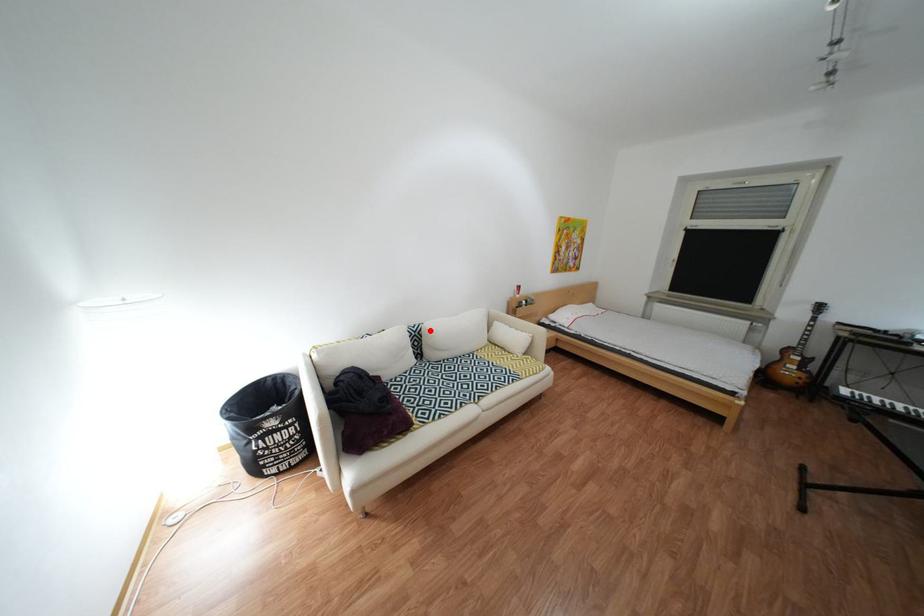
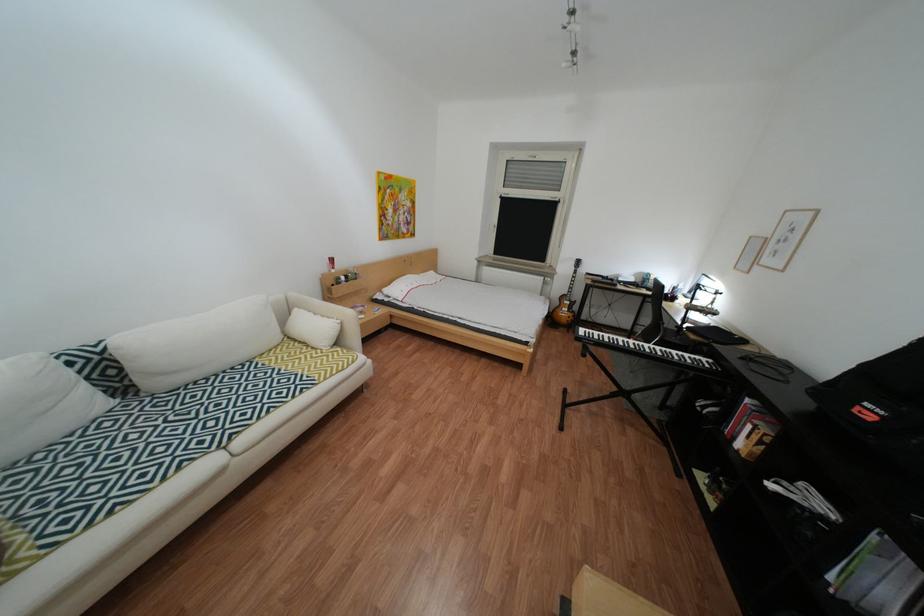
Where in the second image is the point corresponding to the highlighted location from the first image?

(114, 351)